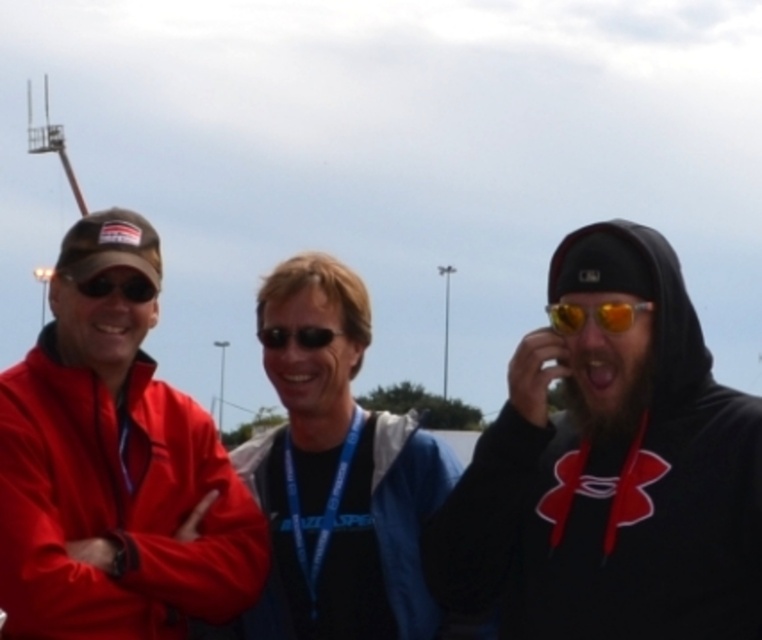
You are a photographer trying to capture a group photo of the three people in the scene. You notice a bright yellow reflective lens at center. To avoid glare, you need to position yourself so that you are not directly facing the glare. Where should you stand relative to the point marked by the coordinates point (594, 316) to avoid the glare?

To avoid the glare from the yellow reflective lens at center, you should position yourself to the side or behind the point marked by point (594, 316), ensuring you are not directly facing it.

You are a photographer trying to capture a group photo of the three people in the scene. You want to ensure that both the blue fabric jacket at center and the yellow reflective lens at center are clearly visible in the photo. Given their sizes, which object should you focus on to ensure both are in frame?

The blue fabric jacket at center is wider than the yellow reflective lens at center, so focusing on the blue fabric jacket at center will ensure both are in frame as it takes up more space.

You are a photographer trying to capture a group photo of the three people in the scene. You want to ensure that the blue fabric jacket at center is clearly visible in the photo. Based on its position, where should you position yourself relative to the group?

The blue fabric jacket at center is located at point (338, 474), so positioning yourself directly in front of the group at the center would ensure the jacket is clearly visible.